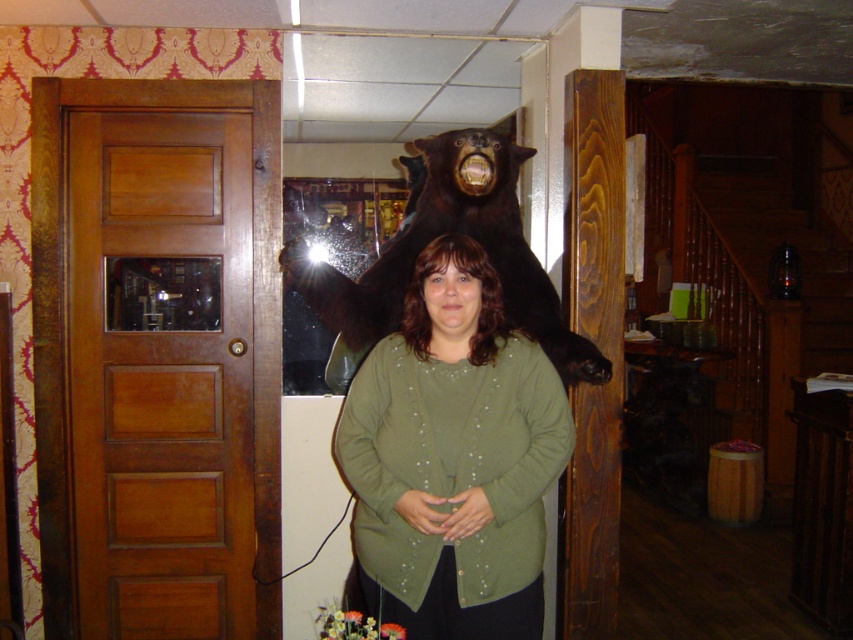
Question: Is shiny brown bear at upper center further to the viewer compared to matte green shirt at center?

Choices:
 (A) no
 (B) yes

Answer: (B)

Question: Which of the following is the farthest from the observer?

Choices:
 (A) olive green sweater at center
 (B) matte green shirt at center

Answer: (B)

Question: Does olive green sweater at center have a lesser width compared to matte green shirt at center?

Choices:
 (A) yes
 (B) no

Answer: (B)

Question: Can you confirm if shiny brown bear at upper center is thinner than matte green shirt at center?

Choices:
 (A) no
 (B) yes

Answer: (A)

Question: Which object appears closest to the camera in this image?

Choices:
 (A) matte green shirt at center
 (B) olive green sweater at center

Answer: (B)

Question: Estimate the real-world distances between objects in this image. Which object is farther from the matte green shirt at center?

Choices:
 (A) shiny brown bear at upper center
 (B) olive green sweater at center

Answer: (A)